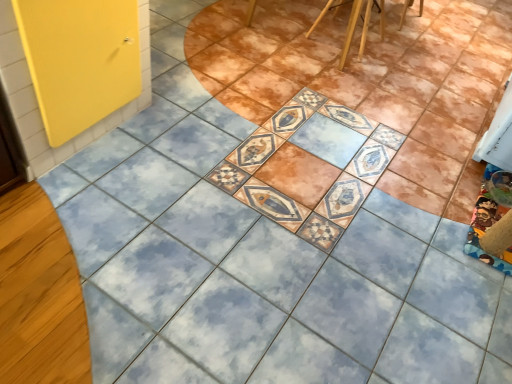
Question: Is wooden chair at upper center positioned far away from wooden chair at upper center?

Choices:
 (A) no
 (B) yes

Answer: (A)

Question: Can you confirm if wooden chair at upper center is thinner than wooden chair at upper center?

Choices:
 (A) yes
 (B) no

Answer: (B)

Question: Is wooden chair at upper center to the left of wooden chair at upper center from the viewer's perspective?

Choices:
 (A) yes
 (B) no

Answer: (A)

Question: Considering the relative sizes of wooden chair at upper center and wooden chair at upper center in the image provided, is wooden chair at upper center taller than wooden chair at upper center?

Choices:
 (A) yes
 (B) no

Answer: (A)

Question: Does wooden chair at upper center have a lesser height compared to wooden chair at upper center?

Choices:
 (A) no
 (B) yes

Answer: (A)

Question: Would you say wooden chair at upper center is part of wooden chair at upper center's contents?

Choices:
 (A) no
 (B) yes

Answer: (B)

Question: From the image's perspective, is wooden chair at upper center located beneath yellow matte door at left?

Choices:
 (A) no
 (B) yes

Answer: (A)

Question: From a real-world perspective, is wooden chair at upper center positioned over yellow matte door at left based on gravity?

Choices:
 (A) yes
 (B) no

Answer: (B)

Question: Considering the relative sizes of wooden chair at upper center and yellow matte door at left in the image provided, is wooden chair at upper center taller than yellow matte door at left?

Choices:
 (A) no
 (B) yes

Answer: (A)

Question: Considering the relative positions of wooden chair at upper center and yellow matte door at left in the image provided, is wooden chair at upper center to the left of yellow matte door at left from the viewer's perspective?

Choices:
 (A) yes
 (B) no

Answer: (B)

Question: Is yellow matte door at left at the back of wooden chair at upper center?

Choices:
 (A) yes
 (B) no

Answer: (B)

Question: Is yellow matte door at left inside wooden chair at upper center?

Choices:
 (A) yes
 (B) no

Answer: (B)

Question: Is yellow matte door at left completely or partially outside of wooden chair at upper center?

Choices:
 (A) yes
 (B) no

Answer: (A)